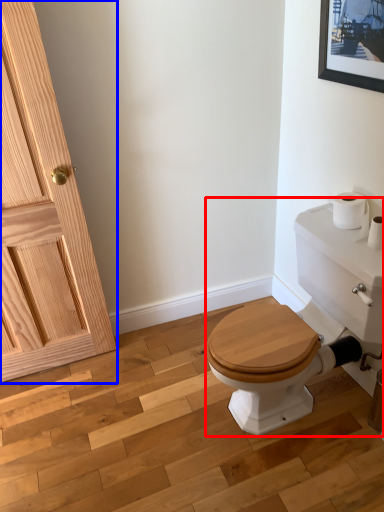
Question: Which point is closer to the camera, porcelain (highlighted by a red box) or door (highlighted by a blue box)?

Choices:
 (A) porcelain
 (B) door

Answer: (A)